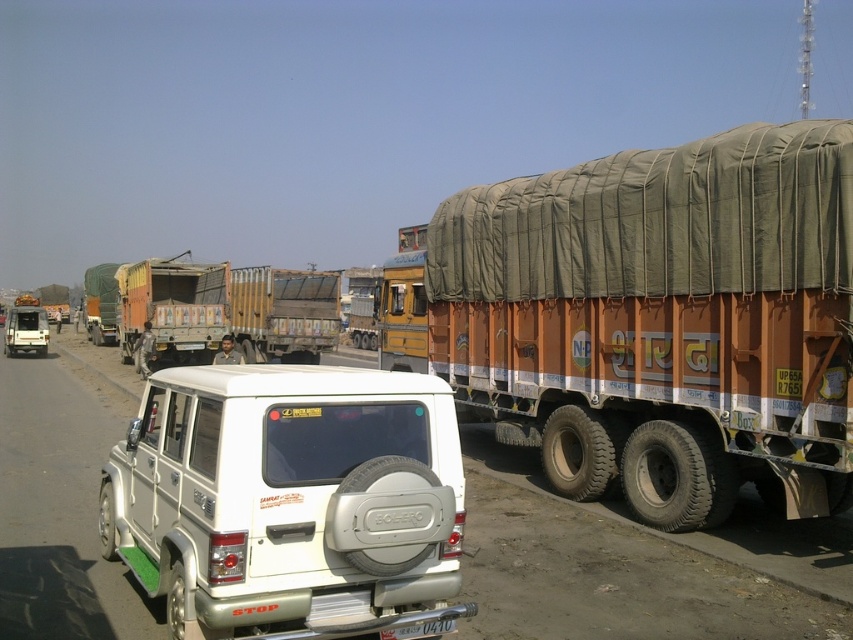
Question: Is brown canvas trailer truck at right thinner than white plastic license plate at center?

Choices:
 (A) no
 (B) yes

Answer: (A)

Question: Does brown canvas trailer truck at right appear over white plastic license plate at center?

Choices:
 (A) yes
 (B) no

Answer: (A)

Question: Is brown canvas trailer truck at right in front of white plastic license plate at center?

Choices:
 (A) no
 (B) yes

Answer: (A)

Question: Which point is closer to the camera?

Choices:
 (A) pos(618,385)
 (B) pos(432,632)

Answer: (B)

Question: Which of the following is the closest to the observer?

Choices:
 (A) brown canvas trailer truck at right
 (B) white plastic license plate at center

Answer: (B)